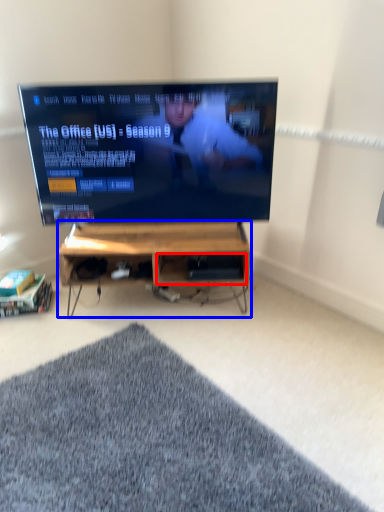
Question: Among these objects, which one is nearest to the camera, shelf (highlighted by a red box) or desk (highlighted by a blue box)?

Choices:
 (A) shelf
 (B) desk

Answer: (B)